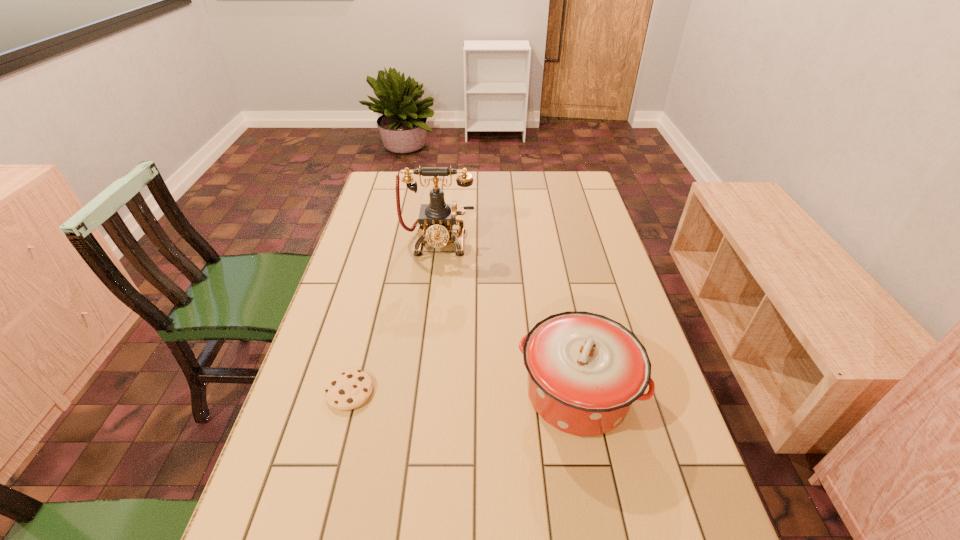
Identify the location of vacant area that lies between the casserole and the cookie. The image size is (960, 540). (464, 393).

Where is `free space between the tallest object and the cookie`? free space between the tallest object and the cookie is located at coordinates (394, 317).

I want to click on vacant area between the farthest object and the second shortest object, so coord(508,318).

Identify the location of free area in between the second shortest object and the cookie. (464, 393).

At what (x,y) coordinates should I click in order to perform the action: click on object that stands as the second closest to the rightmost object. Please return your answer as a coordinate pair (x, y). The image size is (960, 540). Looking at the image, I should click on (436, 219).

The width and height of the screenshot is (960, 540). Find the location of `the second closest object to the telephone`. the second closest object to the telephone is located at coordinates (349, 389).

At what (x,y) coordinates should I click in order to perform the action: click on vacant region that satisfies the following two spatial constraints: 1. on the front of the second shortest object, featuring the rotary dial; 2. on the right side of the tallest object. Please return your answer as a coordinate pair (x, y). This screenshot has width=960, height=540. Looking at the image, I should click on (420, 393).

Where is `vacant area that satisfies the following two spatial constraints: 1. on the front side of the rightmost object; 2. on the left side of the shortest object`? Image resolution: width=960 pixels, height=540 pixels. vacant area that satisfies the following two spatial constraints: 1. on the front side of the rightmost object; 2. on the left side of the shortest object is located at coordinates (349, 393).

Where is `free space that satisfies the following two spatial constraints: 1. on the front of the second shortest object, featuring the rotary dial; 2. on the left side of the telephone`? The height and width of the screenshot is (540, 960). free space that satisfies the following two spatial constraints: 1. on the front of the second shortest object, featuring the rotary dial; 2. on the left side of the telephone is located at coordinates (420, 393).

Locate an element on the screen. The image size is (960, 540). blank area in the image that satisfies the following two spatial constraints: 1. on the front side of the shortest object; 2. on the right side of the rightmost object is located at coordinates (349, 393).